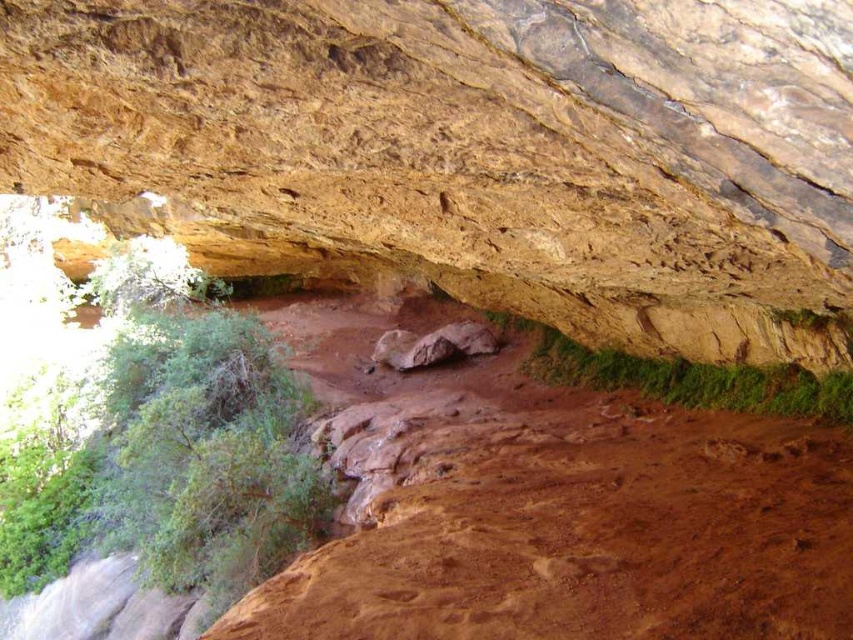
Consider the image. You are a geologist standing at the base of the large overhanging rock face in the image. You notice the brown rough rock at center and the rusty rock at center. Which rock is closer to your current position?

The brown rough rock at center is 5.84 meters away from the rusty rock at center. Since you are at the base of the overhanging rock face, both rocks are likely positioned in front of you. However, without additional information about their exact positions relative to your location, it is impossible to determine which is closer.

You are a hiker trying to navigate through the rocky terrain. You see the brown rough rock at center and the green leafy shrub at left. Which object should you avoid stepping on to prevent damaging the environment?

You should avoid stepping on the green leafy shrub at left because it is smaller and more fragile compared to the brown rough rock at center, which is larger and sturdier.